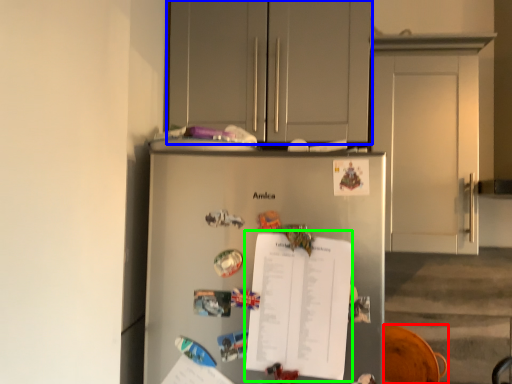
Question: Considering the real-world distances, which object is closest to swivel chair (highlighted by a red box)? cabinetry (highlighted by a blue box) or journal (highlighted by a green box).

Choices:
 (A) cabinetry
 (B) journal

Answer: (B)